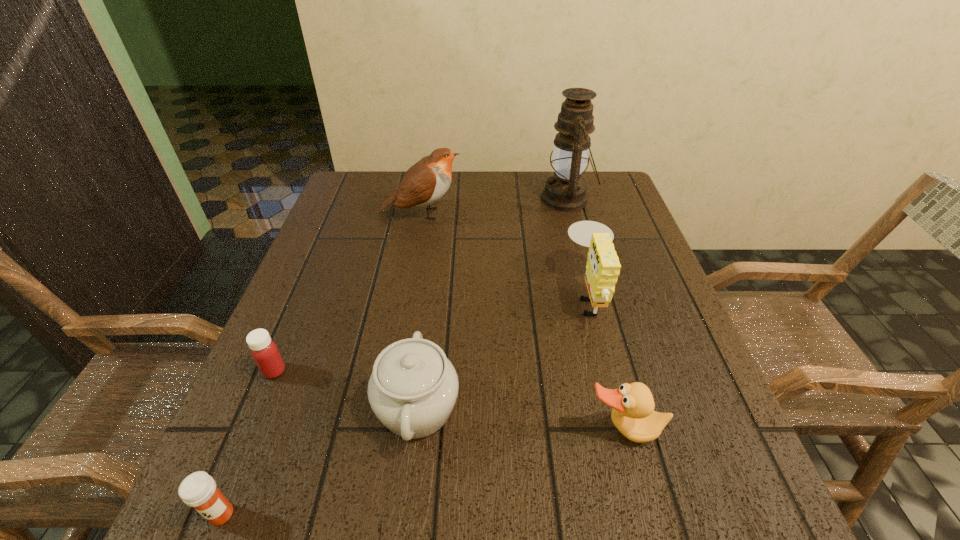
You are a GUI agent. You are given a task and a screenshot of the screen. Output one action in this format:
    pyautogui.click(x=<x>, y=<y>)
    Task: Click on the oil lamp that is at the right edge
    This screenshot has height=540, width=960.
    Given the screenshot: What is the action you would take?
    pyautogui.click(x=565, y=191)

The width and height of the screenshot is (960, 540). I want to click on sponge that is positioned at the right edge, so pyautogui.click(x=603, y=268).

The image size is (960, 540). I want to click on duck at the right edge, so click(633, 414).

Identify the location of object that is at the far left corner. (427, 181).

I want to click on object located at the near left corner, so click(198, 490).

Where is `object at the far right corner`? The image size is (960, 540). object at the far right corner is located at coordinates (565, 191).

In the image, there is a desktop. Where is `vacant region at the far edge`? vacant region at the far edge is located at coordinates (471, 173).

Identify the location of free space at the near edge of the desktop. (540, 482).

Where is `vacant space at the left edge of the desktop`? This screenshot has height=540, width=960. vacant space at the left edge of the desktop is located at coordinates (317, 310).

Find the location of a particular element. This screenshot has width=960, height=540. vacant space at the right edge of the desktop is located at coordinates (644, 292).